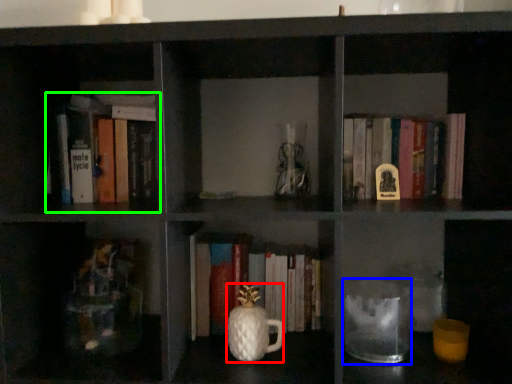
Question: Which is nearer to the glass vase (highlighted by a red box)? glass jar (highlighted by a blue box) or book (highlighted by a green box).

Choices:
 (A) glass jar
 (B) book

Answer: (A)